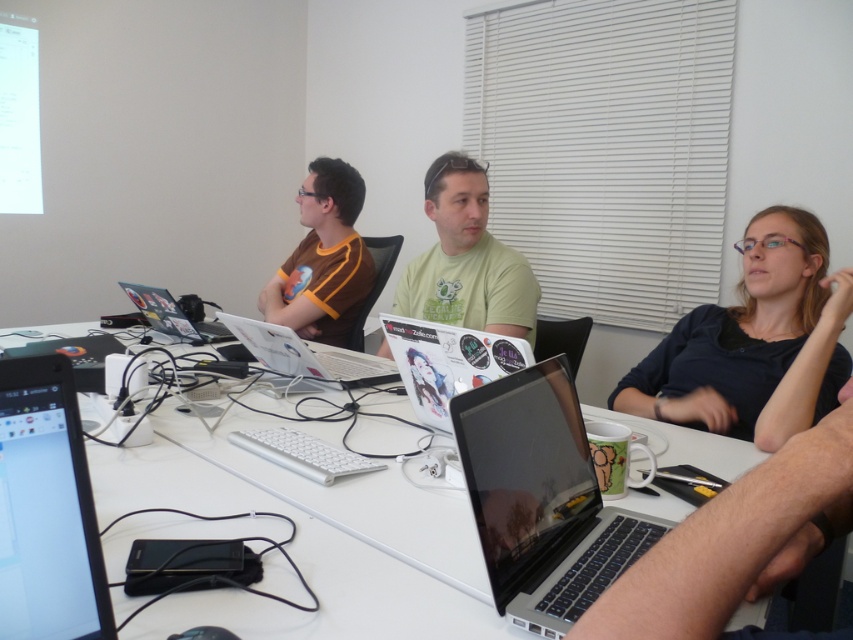
Question: Can you confirm if black matte shirt at right is smaller than green matte shirt at center?

Choices:
 (A) yes
 (B) no

Answer: (A)

Question: Is white glossy table at center in front of black matte shirt at right?

Choices:
 (A) no
 (B) yes

Answer: (B)

Question: Which object appears closest to the camera in this image?

Choices:
 (A) brown jersey at center
 (B) black matte shirt at right

Answer: (B)

Question: Among these points, which one is nearest to the camera?

Choices:
 (A) (271, 369)
 (B) (514, 476)

Answer: (B)

Question: Observing the image, what is the correct spatial positioning of green matte shirt at center in reference to white glossy laptop at center?

Choices:
 (A) above
 (B) below

Answer: (A)

Question: Which point appears closest to the camera in this image?

Choices:
 (A) (355, 269)
 (B) (758, 308)
 (C) (424, 300)
 (D) (300, 364)

Answer: (B)